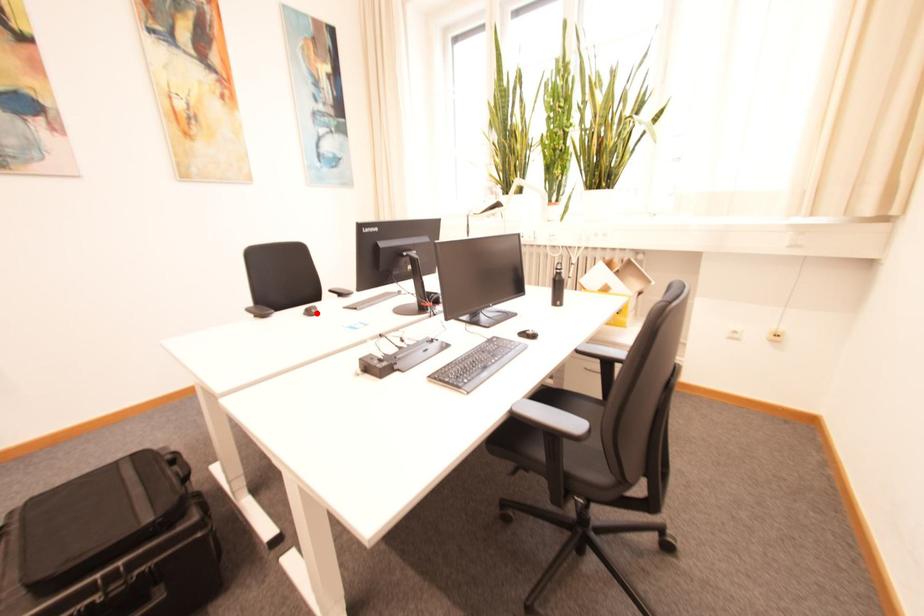
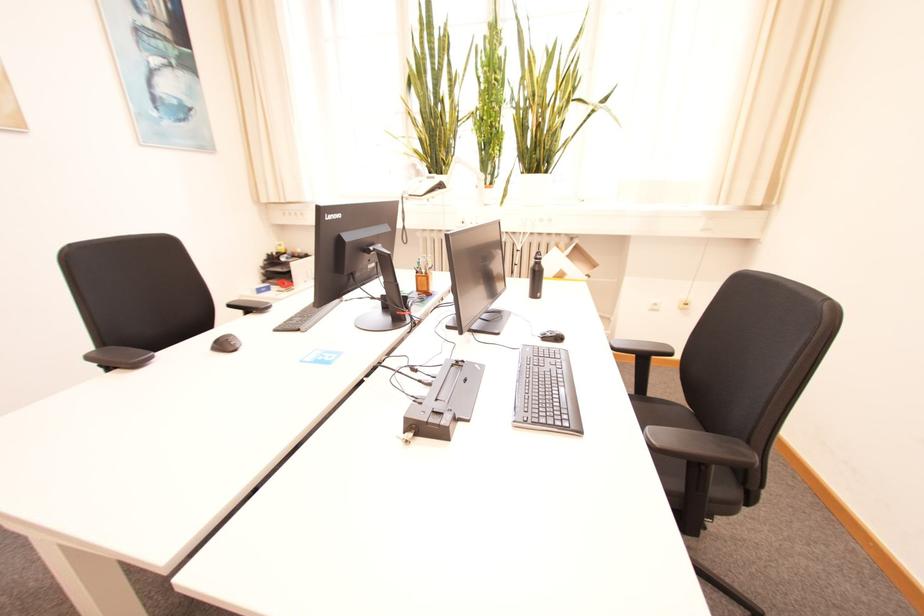
The point at the highlighted location is marked in the first image. Where is the corresponding point in the second image?

(229, 346)